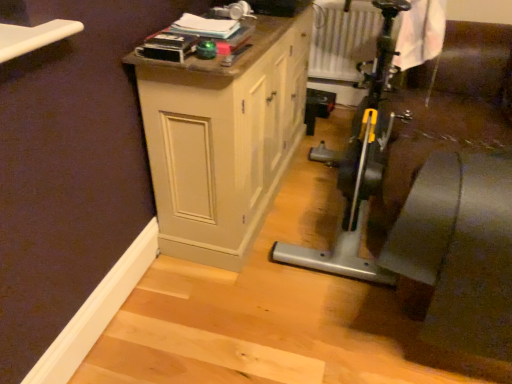
Question: Does matte wood cabinet at center have a lesser height compared to white textured radiator at upper center?

Choices:
 (A) yes
 (B) no

Answer: (B)

Question: Does matte wood cabinet at center have a lesser width compared to white textured radiator at upper center?

Choices:
 (A) yes
 (B) no

Answer: (B)

Question: From a real-world perspective, is matte wood cabinet at center positioned under white textured radiator at upper center based on gravity?

Choices:
 (A) no
 (B) yes

Answer: (B)

Question: Can you confirm if matte wood cabinet at center is smaller than white textured radiator at upper center?

Choices:
 (A) no
 (B) yes

Answer: (A)

Question: Does matte wood cabinet at center have a larger size compared to white textured radiator at upper center?

Choices:
 (A) no
 (B) yes

Answer: (B)

Question: Is matte wood cabinet at center further to the viewer compared to white textured radiator at upper center?

Choices:
 (A) no
 (B) yes

Answer: (A)

Question: Is white textured radiator at upper center wider than matte wood cabinet at center?

Choices:
 (A) no
 (B) yes

Answer: (A)

Question: Is white textured radiator at upper center shorter than matte wood cabinet at center?

Choices:
 (A) no
 (B) yes

Answer: (B)

Question: Is white textured radiator at upper center at the right side of matte wood cabinet at center?

Choices:
 (A) yes
 (B) no

Answer: (A)

Question: Is white textured radiator at upper center smaller than matte wood cabinet at center?

Choices:
 (A) yes
 (B) no

Answer: (A)

Question: Is white textured radiator at upper center next to matte wood cabinet at center?

Choices:
 (A) yes
 (B) no

Answer: (B)

Question: Can you confirm if white textured radiator at upper center is positioned to the left of matte wood cabinet at center?

Choices:
 (A) no
 (B) yes

Answer: (A)

Question: Would you say white textured radiator at upper center is to the left or to the right of matte wood cabinet at center in the picture?

Choices:
 (A) left
 (B) right

Answer: (B)